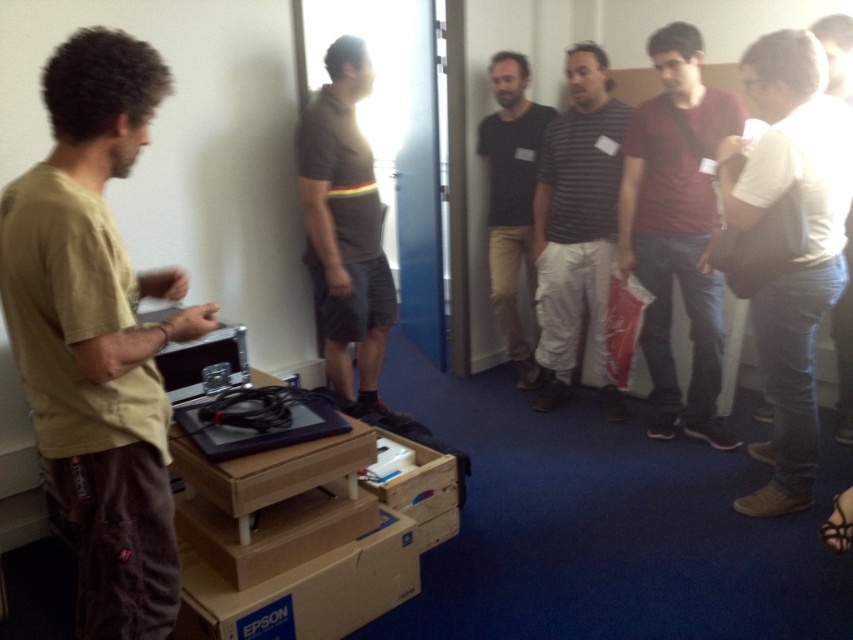
You are standing in the room and want to move towards the two points marked in the image. Which point, point (131,132) or point (679,218), would you reach first if you walk straight towards them?

Point (131,132) is closer to the camera than point (679,218), so you would reach point (131,132) first.

You are organizing a meeting in this room and need to place a name tag on the wooden crate at center. However, there is a white cotton shirt at right nearby. Based on their positions, which object is closer to the door located in the background?

The wooden crate at center is closer to the door located in the background because the white cotton shirt at right is positioned to its right, meaning the crate is between the shirt and the door.

You are a delivery person who just arrived at the office. You see the white cotton shirt at right and the brown cardboard box at lower center. Which object is taller?

The white cotton shirt at right is taller than the brown cardboard box at lower center.